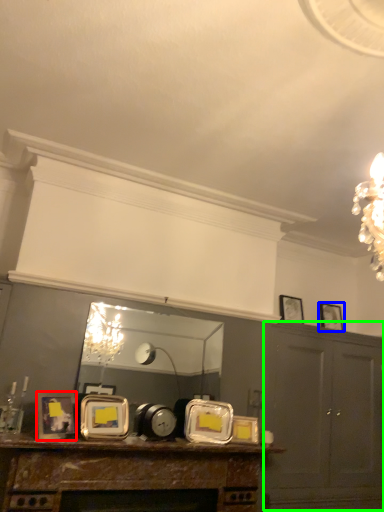
Question: Considering the real-world distances, which object is farthest from picture frame (highlighted by a red box)? picture frame (highlighted by a blue box) or cabinetry (highlighted by a green box)?

Choices:
 (A) picture frame
 (B) cabinetry

Answer: (A)